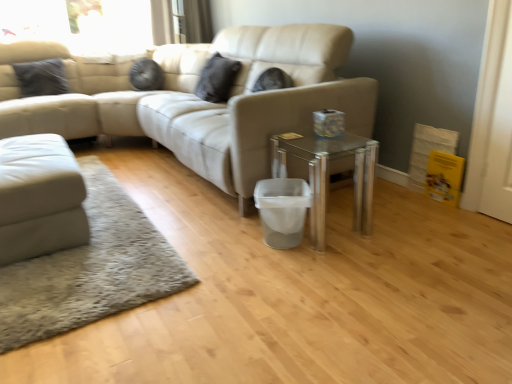
How much space does black matte pillow at upper left, the 2th pillow in the right-to-left sequence, occupy vertically?

black matte pillow at upper left, the 2th pillow in the right-to-left sequence, is 14.81 inches in height.

The height and width of the screenshot is (384, 512). Describe the element at coordinates (41, 77) in the screenshot. I see `black matte pillow at upper left, which appears as the 1th pillow when viewed from the left` at that location.

What do you see at coordinates (328, 176) in the screenshot? I see `transparent glass table at center` at bounding box center [328, 176].

Describe the element at coordinates (492, 121) in the screenshot. I see `white wood screen door at right` at that location.

The width and height of the screenshot is (512, 384). What are the coordinates of `white wood screen door at right` in the screenshot? It's located at (492, 121).

This screenshot has width=512, height=384. What do you see at coordinates (39, 198) in the screenshot? I see `white leather ottoman at lower left, which is counted as the 1th studio couch, starting from the left` at bounding box center [39, 198].

At what (x,y) coordinates should I click in order to perform the action: click on black matte pillow at upper left, the 2th pillow in the right-to-left sequence. Please return your answer as a coordinate pair (x, y). The image size is (512, 384). Looking at the image, I should click on (41, 77).

Is black matte pillow at upper left, which appears as the 1th pillow when viewed from the left, looking in the opposite direction of white wood screen door at right?

black matte pillow at upper left, which appears as the 1th pillow when viewed from the left, does not have its back to white wood screen door at right.

From the image's perspective, is black matte pillow at upper left, the 2th pillow in the right-to-left sequence, located beneath white wood screen door at right?

No, from the image's perspective, black matte pillow at upper left, the 2th pillow in the right-to-left sequence, is not beneath white wood screen door at right.

How different are the orientations of black matte pillow at upper left, the 2th pillow in the right-to-left sequence, and white wood screen door at right in degrees?

87.6 degrees separate the facing orientations of black matte pillow at upper left, the 2th pillow in the right-to-left sequence, and white wood screen door at right.

Is black matte pillow at upper left, the 2th pillow in the right-to-left sequence, in front of or behind white wood screen door at right in the image?

Visually, black matte pillow at upper left, the 2th pillow in the right-to-left sequence, is located behind white wood screen door at right.

Is point (469, 157) in front of point (206, 68)?

Yes.

From the image's perspective, does white wood screen door at right appear higher than matte black pillow at upper center, marked as the first pillow in a right-to-left arrangement?

No, from the image's perspective, white wood screen door at right is not over matte black pillow at upper center, marked as the first pillow in a right-to-left arrangement.

Considering the positions of objects white wood screen door at right and matte black pillow at upper center, marked as the first pillow in a right-to-left arrangement, in the image provided, who is more to the left, white wood screen door at right or matte black pillow at upper center, marked as the first pillow in a right-to-left arrangement,?

matte black pillow at upper center, marked as the first pillow in a right-to-left arrangement, is more to the left.

Is white wood screen door at right wider than matte black pillow at upper center, the 2th pillow in the left-to-right sequence?

Incorrect, the width of white wood screen door at right does not surpass that of matte black pillow at upper center, the 2th pillow in the left-to-right sequence.

Does white leather ottoman at lower left, which ranks as the second studio couch in right-to-left order, turn towards black matte pillow at upper left, which appears as the 1th pillow when viewed from the left?

No.

Considering the positions of objects white leather ottoman at lower left, which ranks as the second studio couch in right-to-left order, and black matte pillow at upper left, which appears as the 1th pillow when viewed from the left, in the image provided, who is more to the left, white leather ottoman at lower left, which ranks as the second studio couch in right-to-left order, or black matte pillow at upper left, which appears as the 1th pillow when viewed from the left,?

black matte pillow at upper left, which appears as the 1th pillow when viewed from the left.

Does white leather ottoman at lower left, which is counted as the 1th studio couch, starting from the left, have a greater width compared to black matte pillow at upper left, which appears as the 1th pillow when viewed from the left?

Yes.

Which is farther from the camera, (1,166) or (48,74)?

Point (48,74)

From a real-world perspective, which object stands above the other?

From a 3D spatial view, white wood screen door at right is above.

Considering the relative sizes of white wood screen door at right and white leather ottoman at lower left, which ranks as the second studio couch in right-to-left order, in the image provided, is white wood screen door at right bigger than white leather ottoman at lower left, which ranks as the second studio couch in right-to-left order,?

No, white wood screen door at right is not bigger than white leather ottoman at lower left, which ranks as the second studio couch in right-to-left order.

Is white wood screen door at right turned away from white leather ottoman at lower left, which is counted as the 1th studio couch, starting from the left?

white wood screen door at right does not have its back to white leather ottoman at lower left, which is counted as the 1th studio couch, starting from the left.

Is white wood screen door at right not inside white leather ottoman at lower left, which is counted as the 1th studio couch, starting from the left?

white wood screen door at right lies outside white leather ottoman at lower left, which is counted as the 1th studio couch, starting from the left,'s area.

Based on the photo, can you confirm if black matte pillow at upper left, which appears as the 1th pillow when viewed from the left, is bigger than white leather ottoman at lower left, which ranks as the second studio couch in right-to-left order?

Actually, black matte pillow at upper left, which appears as the 1th pillow when viewed from the left, might be smaller than white leather ottoman at lower left, which ranks as the second studio couch in right-to-left order.

From the image's perspective, is black matte pillow at upper left, which appears as the 1th pillow when viewed from the left, located above or below white leather ottoman at lower left, which is counted as the 1th studio couch, starting from the left?

black matte pillow at upper left, which appears as the 1th pillow when viewed from the left, is situated higher than white leather ottoman at lower left, which is counted as the 1th studio couch, starting from the left, in the image.

Consider the image. Considering their positions, is black matte pillow at upper left, the 2th pillow in the right-to-left sequence, located in front of or behind white leather ottoman at lower left, which is counted as the 1th studio couch, starting from the left?

In the image, black matte pillow at upper left, the 2th pillow in the right-to-left sequence, appears behind white leather ottoman at lower left, which is counted as the 1th studio couch, starting from the left.

Would you consider black matte pillow at upper left, the 2th pillow in the right-to-left sequence, to be distant from white leather ottoman at lower left, which is counted as the 1th studio couch, starting from the left?

Yes, black matte pillow at upper left, the 2th pillow in the right-to-left sequence, and white leather ottoman at lower left, which is counted as the 1th studio couch, starting from the left, are quite far apart.

Do you think white wood screen door at right is within beige leather couch at center, arranged as the 2th studio couch when viewed from the left, or outside of it?

white wood screen door at right is outside beige leather couch at center, arranged as the 2th studio couch when viewed from the left.

Is white wood screen door at right far away from beige leather couch at center, positioned as the first studio couch in right-to-left order?

Absolutely, white wood screen door at right is distant from beige leather couch at center, positioned as the first studio couch in right-to-left order.

Does white wood screen door at right turn towards beige leather couch at center, positioned as the first studio couch in right-to-left order?

No, white wood screen door at right is not facing towards beige leather couch at center, positioned as the first studio couch in right-to-left order.

From a real-world perspective, is white wood screen door at right located higher than beige leather couch at center, positioned as the first studio couch in right-to-left order?

Indeed, from a real-world perspective, white wood screen door at right stands above beige leather couch at center, positioned as the first studio couch in right-to-left order.

Which is more to the left, transparent glass table at center or beige leather couch at center, arranged as the 2th studio couch when viewed from the left?

beige leather couch at center, arranged as the 2th studio couch when viewed from the left.

Is beige leather couch at center, positioned as the first studio couch in right-to-left order, located within transparent glass table at center?

Definitely not — beige leather couch at center, positioned as the first studio couch in right-to-left order, is not inside transparent glass table at center.

Considering the points (324, 175) and (179, 99), which point is behind, point (324, 175) or point (179, 99)?

Positioned behind is point (179, 99).

Is transparent glass table at center further to the viewer compared to beige leather couch at center, positioned as the first studio couch in right-to-left order?

No, transparent glass table at center is closer to the viewer.

You are a GUI agent. You are given a task and a screenshot of the screen. Output one action in this format:
    pyautogui.click(x=<x>, y=<y>)
    Task: Click on the screen door below the black matte pillow at upper left, the 2th pillow in the right-to-left sequence (from the image's perspective)
    
    Given the screenshot: What is the action you would take?
    pyautogui.click(x=492, y=121)

From the white wood screen door at right, count 1st pillows backward and point to it. Please provide its 2D coordinates.

[(217, 79)]

Looking at the image, which one is located closer to black matte pillow at upper left, which appears as the 1th pillow when viewed from the left, transparent glass table at center or beige leather couch at center, positioned as the first studio couch in right-to-left order?

beige leather couch at center, positioned as the first studio couch in right-to-left order, is closer to black matte pillow at upper left, which appears as the 1th pillow when viewed from the left.

When comparing their distances from white wood screen door at right, does white leather ottoman at lower left, which ranks as the second studio couch in right-to-left order, or transparent glass table at center seem further?

white leather ottoman at lower left, which ranks as the second studio couch in right-to-left order.

Which object lies nearer to the anchor point transparent glass table at center, beige leather couch at center, arranged as the 2th studio couch when viewed from the left, or matte black pillow at upper center, marked as the first pillow in a right-to-left arrangement?

beige leather couch at center, arranged as the 2th studio couch when viewed from the left.

Estimate the real-world distances between objects in this image. Which object is further from white wood screen door at right, black matte pillow at upper left, which appears as the 1th pillow when viewed from the left, or beige leather couch at center, positioned as the first studio couch in right-to-left order?

black matte pillow at upper left, which appears as the 1th pillow when viewed from the left, is further to white wood screen door at right.

Estimate the real-world distances between objects in this image. Which object is closer to white leather ottoman at lower left, which ranks as the second studio couch in right-to-left order, black matte pillow at upper left, which appears as the 1th pillow when viewed from the left, or white wood screen door at right?

black matte pillow at upper left, which appears as the 1th pillow when viewed from the left.

From the image, which object appears to be nearer to white wood screen door at right, beige leather couch at center, arranged as the 2th studio couch when viewed from the left, or black matte pillow at upper left, the 2th pillow in the right-to-left sequence?

beige leather couch at center, arranged as the 2th studio couch when viewed from the left, is closer to white wood screen door at right.

Which object lies nearer to the anchor point transparent glass table at center, matte black pillow at upper center, the 2th pillow in the left-to-right sequence, or black matte pillow at upper left, the 2th pillow in the right-to-left sequence?

Based on the image, matte black pillow at upper center, the 2th pillow in the left-to-right sequence, appears to be nearer to transparent glass table at center.

Considering their positions, is white wood screen door at right positioned further to matte black pillow at upper center, marked as the first pillow in a right-to-left arrangement, than transparent glass table at center?

Based on the image, white wood screen door at right appears to be further to matte black pillow at upper center, marked as the first pillow in a right-to-left arrangement.

You are a GUI agent. You are given a task and a screenshot of the screen. Output one action in this format:
    pyautogui.click(x=<x>, y=<y>)
    Task: Click on the pillow between black matte pillow at upper left, which appears as the 1th pillow when viewed from the left, and white wood screen door at right, in the horizontal direction
    
    Given the screenshot: What is the action you would take?
    click(x=217, y=79)

I want to click on table located between white leather ottoman at lower left, which ranks as the second studio couch in right-to-left order, and white wood screen door at right in the left-right direction, so click(328, 176).

Locate an element on the screen. Image resolution: width=512 pixels, height=384 pixels. table situated between black matte pillow at upper left, the 2th pillow in the right-to-left sequence, and white wood screen door at right from left to right is located at coordinates (328, 176).

Locate an element on the screen. pillow located between white leather ottoman at lower left, which ranks as the second studio couch in right-to-left order, and black matte pillow at upper left, the 2th pillow in the right-to-left sequence, in the depth direction is located at coordinates (217, 79).